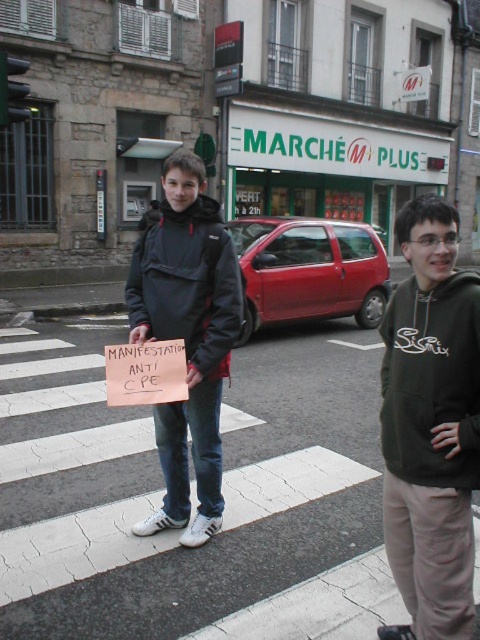
Which is in front, point (444, 252) or point (201, 234)?

Point (444, 252) is in front.

Does dark green hoodie at center appear under matte black jacket at center?

Yes, dark green hoodie at center is below matte black jacket at center.

Is point (460, 365) positioned behind point (217, 262)?

No, (460, 365) is in front of (217, 262).

Locate an element on the screen. dark green hoodie at center is located at coordinates (431, 426).